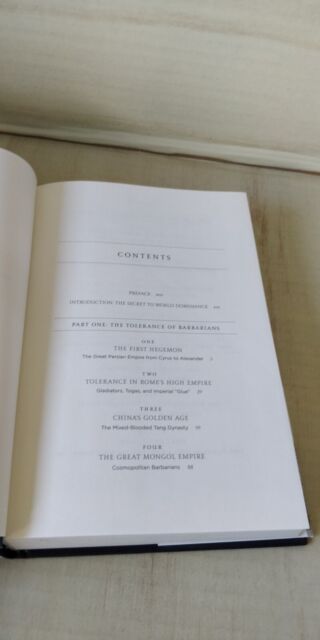
What are the coordinates of `cover` in the screenshot? It's located at (130, 548).